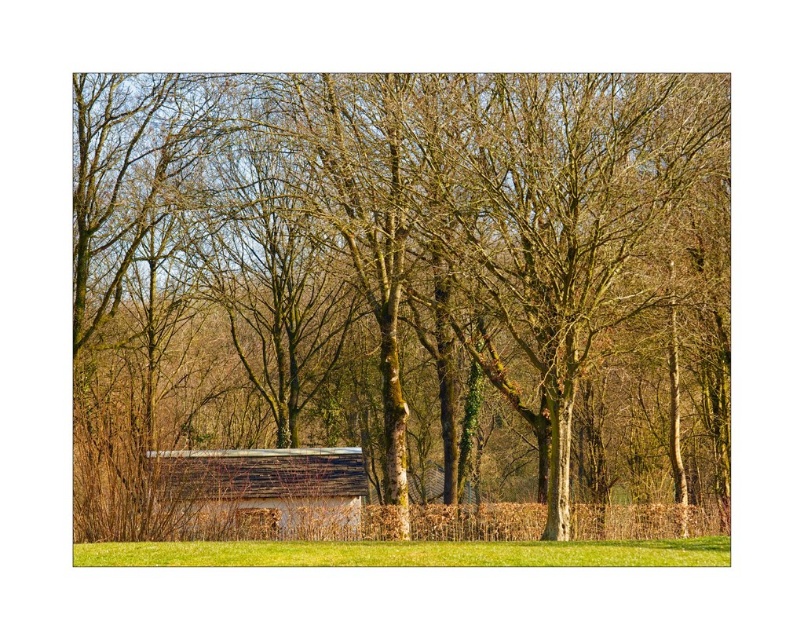
You are standing in the rural scene and want to walk towards the small structure behind the grassy area. Which direction should you move relative to the brown bark tree at center?

The brown bark tree at center is located at point [402,305], so you should move behind the brown bark tree at center towards the structure.

You are planning to set up a picnic blanket in the green grass at lower center. Considering the space available, will the wooden hut at center interfere with your setup?

The wooden hut at center might be wider than green grass at lower center, so it could potentially block part of the grass area, making it necessary to adjust the picnic setup accordingly.